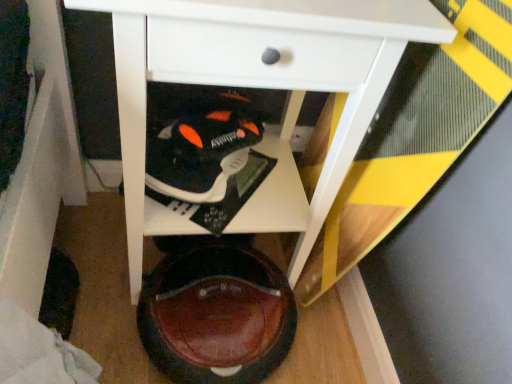
Question: Is brown leather shoe at lower center, arranged as the 1th footwear when ordered from the bottom, smaller than black matte sneaker at center, positioned as the 1th footwear in top-to-bottom order?

Choices:
 (A) yes
 (B) no

Answer: (B)

Question: From a real-world perspective, is brown leather shoe at lower center, arranged as the 1th footwear when ordered from the bottom, positioned under black matte sneaker at center, positioned as the 1th footwear in top-to-bottom order, based on gravity?

Choices:
 (A) no
 (B) yes

Answer: (B)

Question: Is brown leather shoe at lower center, which is counted as the second footwear, starting from the top, positioned in front of black matte sneaker at center, arranged as the 2th footwear when ordered from the bottom?

Choices:
 (A) yes
 (B) no

Answer: (A)

Question: Can you confirm if brown leather shoe at lower center, which is counted as the second footwear, starting from the top, is wider than black matte sneaker at center, arranged as the 2th footwear when ordered from the bottom?

Choices:
 (A) no
 (B) yes

Answer: (B)

Question: Can you confirm if brown leather shoe at lower center, arranged as the 1th footwear when ordered from the bottom, is positioned to the right of black matte sneaker at center, positioned as the 1th footwear in top-to-bottom order?

Choices:
 (A) yes
 (B) no

Answer: (A)

Question: Is brown leather shoe at lower center, which is counted as the second footwear, starting from the top, taller than black matte sneaker at center, positioned as the 1th footwear in top-to-bottom order?

Choices:
 (A) yes
 (B) no

Answer: (A)

Question: Is white glossy table at center positioned with its back to brown leather shoe at lower center, which is counted as the second footwear, starting from the top?

Choices:
 (A) no
 (B) yes

Answer: (A)

Question: From the image's perspective, is white glossy table at center located beneath brown leather shoe at lower center, which is counted as the second footwear, starting from the top?

Choices:
 (A) yes
 (B) no

Answer: (B)

Question: Considering the relative positions of white glossy table at center and brown leather shoe at lower center, which is counted as the second footwear, starting from the top, in the image provided, is white glossy table at center behind brown leather shoe at lower center, which is counted as the second footwear, starting from the top,?

Choices:
 (A) no
 (B) yes

Answer: (A)

Question: From the image's perspective, is white glossy table at center over brown leather shoe at lower center, arranged as the 1th footwear when ordered from the bottom?

Choices:
 (A) no
 (B) yes

Answer: (B)

Question: Is white glossy table at center smaller than brown leather shoe at lower center, which is counted as the second footwear, starting from the top?

Choices:
 (A) no
 (B) yes

Answer: (A)

Question: Is white glossy table at center taller than brown leather shoe at lower center, arranged as the 1th footwear when ordered from the bottom?

Choices:
 (A) yes
 (B) no

Answer: (A)

Question: Is black matte sneaker at center, positioned as the 1th footwear in top-to-bottom order, in front of white glossy table at center?

Choices:
 (A) no
 (B) yes

Answer: (A)